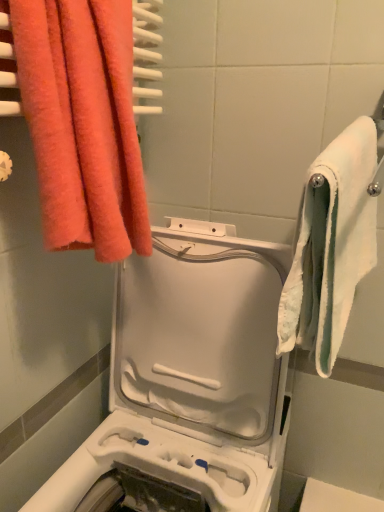
Question: Considering the relative sizes of white soft towel at right, the first towel in the right-to-left sequence, and white plastic washing machine at center in the image provided, is white soft towel at right, the first towel in the right-to-left sequence, shorter than white plastic washing machine at center?

Choices:
 (A) no
 (B) yes

Answer: (B)

Question: From the image's perspective, is white soft towel at right, the first towel in the right-to-left sequence, on top of white plastic washing machine at center?

Choices:
 (A) yes
 (B) no

Answer: (A)

Question: Considering the relative sizes of white soft towel at right, placed as the second towel when sorted from left to right, and white plastic washing machine at center in the image provided, is white soft towel at right, placed as the second towel when sorted from left to right, thinner than white plastic washing machine at center?

Choices:
 (A) yes
 (B) no

Answer: (A)

Question: Considering the relative positions of white soft towel at right, the first towel in the right-to-left sequence, and white plastic washing machine at center in the image provided, is white soft towel at right, the first towel in the right-to-left sequence, to the left of white plastic washing machine at center from the viewer's perspective?

Choices:
 (A) yes
 (B) no

Answer: (B)

Question: Does white soft towel at right, placed as the second towel when sorted from left to right, have a smaller size compared to white plastic washing machine at center?

Choices:
 (A) no
 (B) yes

Answer: (B)

Question: Does point (248, 375) appear closer or farther from the camera than point (349, 82)?

Choices:
 (A) farther
 (B) closer

Answer: (B)

Question: Is white plastic washing machine at center spatially inside white fabric towel at right, or outside of it?

Choices:
 (A) outside
 (B) inside

Answer: (A)

Question: Is white plastic washing machine at center wider or thinner than white fabric towel at right?

Choices:
 (A) wide
 (B) thin

Answer: (A)

Question: Considering the positions of white plastic washing machine at center and white fabric towel at right in the image, is white plastic washing machine at center taller or shorter than white fabric towel at right?

Choices:
 (A) tall
 (B) short

Answer: (A)

Question: Is white plastic washing machine at center to the left or to the right of fluffy coral towel at upper left, the 2th towel in the right-to-left sequence, in the image?

Choices:
 (A) left
 (B) right

Answer: (B)

Question: Considering the positions of white plastic washing machine at center and fluffy coral towel at upper left, the 2th towel in the right-to-left sequence, in the image, is white plastic washing machine at center bigger or smaller than fluffy coral towel at upper left, the 2th towel in the right-to-left sequence,?

Choices:
 (A) big
 (B) small

Answer: (A)

Question: Considering the positions of point (230, 440) and point (64, 74), is point (230, 440) closer or farther from the camera than point (64, 74)?

Choices:
 (A) farther
 (B) closer

Answer: (A)

Question: In terms of width, does white plastic washing machine at center look wider or thinner when compared to fluffy coral towel at upper left, the 2th towel in the right-to-left sequence?

Choices:
 (A) wide
 (B) thin

Answer: (A)

Question: Based on their sizes in the image, would you say white soft towel at right, placed as the second towel when sorted from left to right, is bigger or smaller than white plastic washing machine at center?

Choices:
 (A) small
 (B) big

Answer: (A)

Question: From the image's perspective, is white soft towel at right, the first towel in the right-to-left sequence, above or below white plastic washing machine at center?

Choices:
 (A) above
 (B) below

Answer: (A)